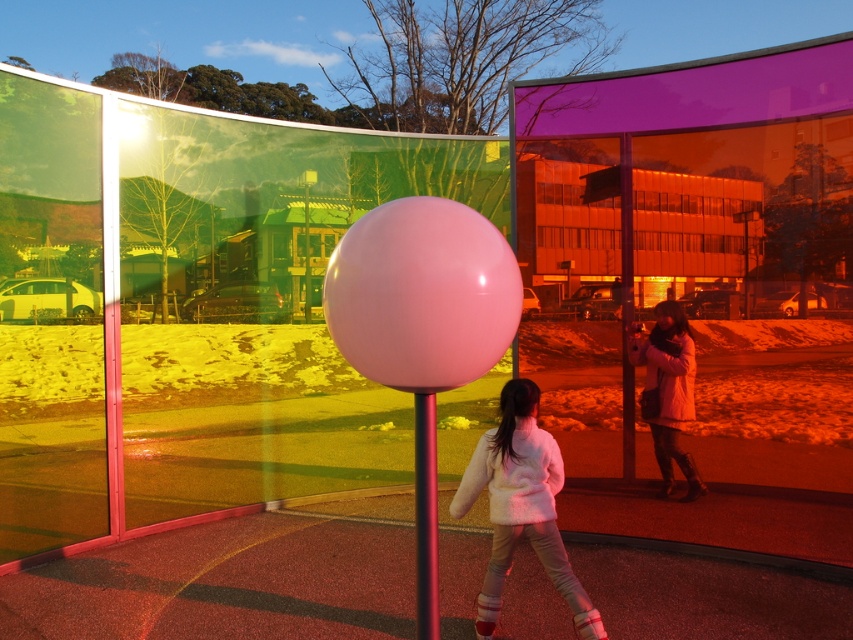
You are trying to hang your white fluffy coat at center on the glossy plastic pole at center. Can you determine if the coat will fit around the pole?

The white fluffy coat at center might be wider than glossy plastic pole at center, so there is a possibility that the coat will fit around the pole depending on the coat and pole dimensions.

You are a delivery person who needs to place a package between the white fluffy coat at center and the glossy plastic pole at center. The package requires a minimum of 2 meters of space to be placed safely. Can you fit the package between them?

The distance between the white fluffy coat at center and the glossy plastic pole at center is 1.88 meters, which is less than the required 2 meters. Therefore, the package cannot be safely placed between them.